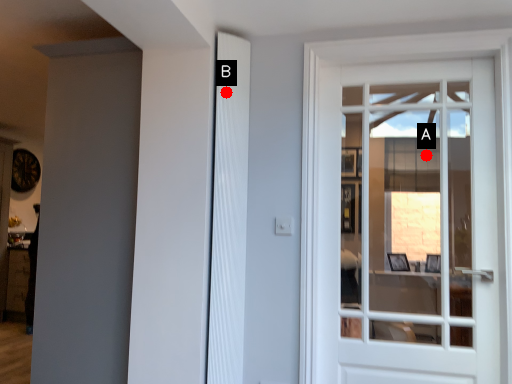
Question: Two points are circled on the image, labeled by A and B beside each circle. Among these points, which one is nearest to the camera?

Choices:
 (A) A is closer
 (B) B is closer

Answer: (B)